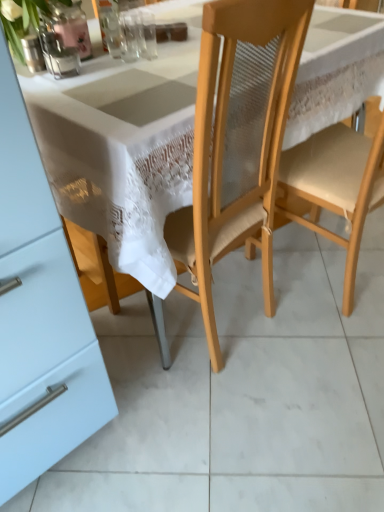
The height and width of the screenshot is (512, 384). Find the location of `free location in front of clear glass vase at upper center, the 2th tableware when ordered from left to right`. free location in front of clear glass vase at upper center, the 2th tableware when ordered from left to right is located at coordinates (122, 57).